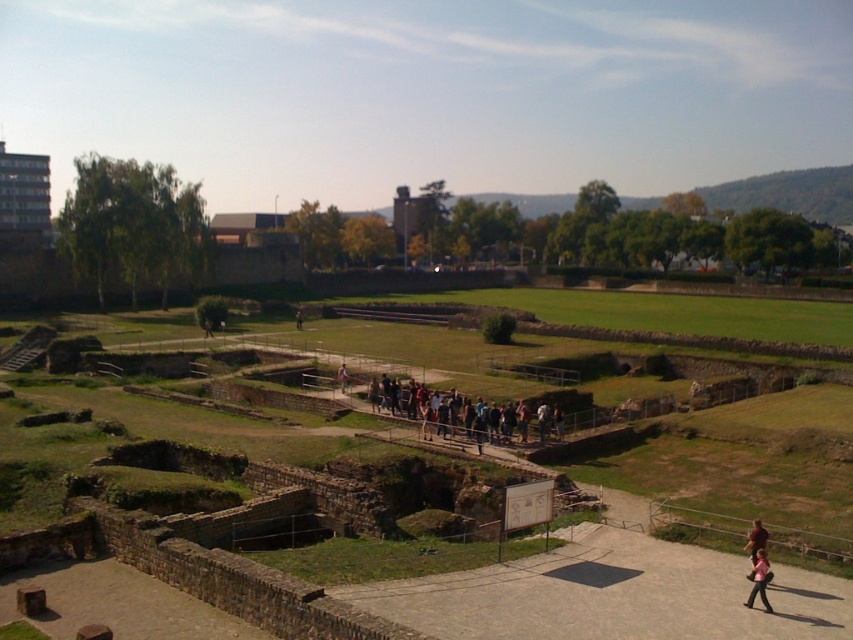
You are standing at the archaeological site and want to take a photo that includes both the point at location (581, 589) and the point at (757, 522). Which point will appear larger in your photo?

Point at location (581, 589) will appear larger in the photo because it is closer to the camera than point at location (757, 522).

You are a tourist visiting the archaeological site and want to take a photo of the smooth stone pathway at center and the brown leather jacket at lower right. Which object should you focus on first if you want to capture both in one frame without moving the camera?

The smooth stone pathway at center is bigger than the brown leather jacket at lower right, so focusing on the smooth stone pathway at center first would allow both objects to fit within the frame more effectively.